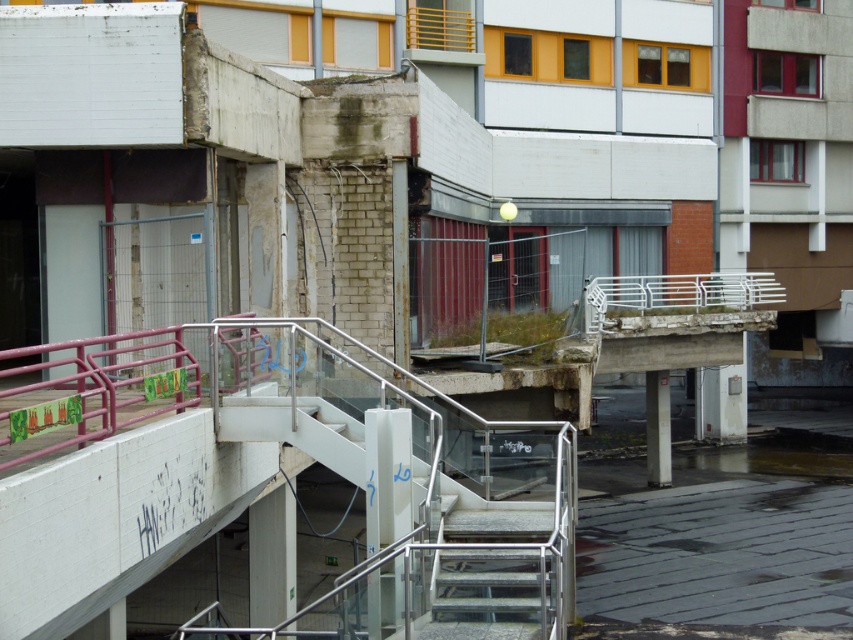
Question: From the image, what is the correct spatial relationship of metallic pink railing at center in relation to metallic gray stairs at center?

Choices:
 (A) left
 (B) right

Answer: (A)

Question: Does metallic pink railing at center have a larger size compared to metallic gray stairs at center?

Choices:
 (A) no
 (B) yes

Answer: (A)

Question: Among these points, which one is farthest from the camera?

Choices:
 (A) (426, 394)
 (B) (415, 512)

Answer: (A)

Question: Among these objects, which one is farthest from the camera?

Choices:
 (A) metallic gray stairs at center
 (B) metallic pink railing at center

Answer: (B)

Question: Can you confirm if metallic pink railing at center is smaller than metallic gray stairs at center?

Choices:
 (A) no
 (B) yes

Answer: (B)

Question: Which object is farther from the camera taking this photo?

Choices:
 (A) metallic pink railing at center
 (B) metallic gray stairs at center

Answer: (A)